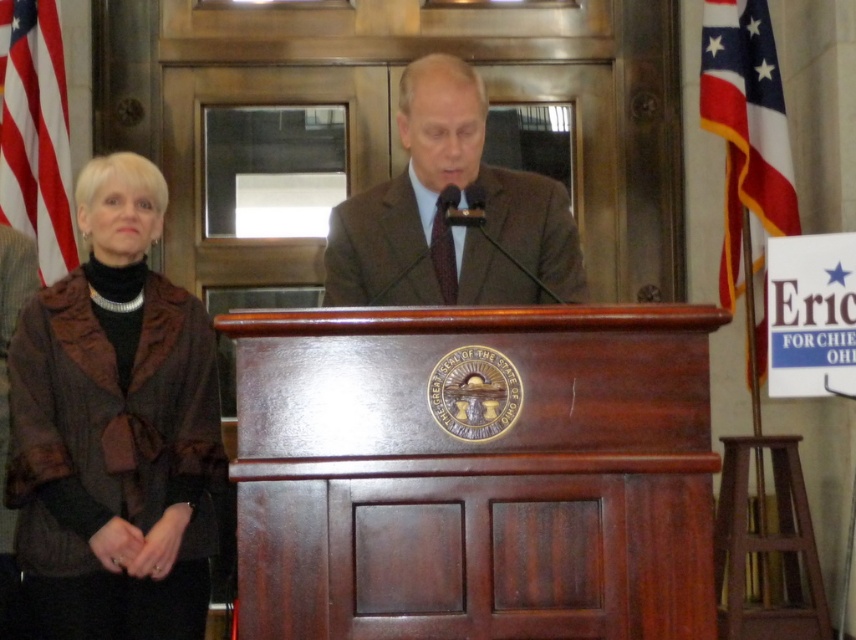
Is point (129, 620) farther from camera compared to point (27, 28)?

No.

Who is shorter, brown textured coat at left or red fabric flag at left?

With less height is red fabric flag at left.

Find the location of `brown textured coat at left`. brown textured coat at left is located at coordinates (114, 428).

Can you confirm if brown textured suit at center is positioned below red fabric flag at left?

Correct, brown textured suit at center is located below red fabric flag at left.

This screenshot has width=856, height=640. What are the coordinates of `brown textured suit at center` in the screenshot? It's located at (444, 211).

Is point (193, 451) farther from viewer compared to point (494, 257)?

Yes.

Can you confirm if brown textured coat at left is taller than brown textured suit at center?

Indeed, brown textured coat at left has a greater height compared to brown textured suit at center.

Is point (98, 208) farther from viewer compared to point (531, 192)?

Yes, it is behind point (531, 192).

The image size is (856, 640). I want to click on brown textured coat at left, so click(114, 428).